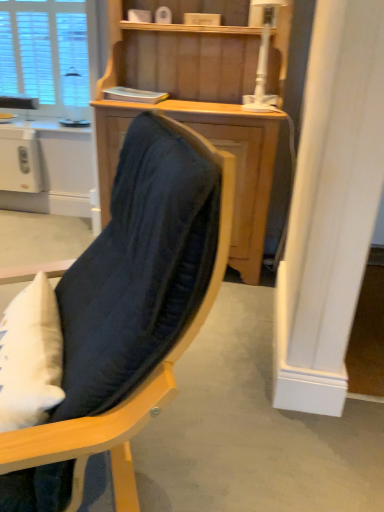
At what (x,y) coordinates should I click in order to perform the action: click on velvet dark blue chair at center. Please return your answer as a coordinate pair (x, y). Image resolution: width=384 pixels, height=512 pixels. Looking at the image, I should click on (144, 274).

At what (x,y) coordinates should I click in order to perform the action: click on white plastic lamp at upper center. Please return your answer as a coordinate pair (x, y). Looking at the image, I should click on (263, 59).

Identify the location of wooden cabinet at center. Image resolution: width=384 pixels, height=512 pixels. (195, 103).

Locate an element on the screen. velvet dark blue chair at center is located at coordinates (144, 274).

Does wooden cabinet at center appear on the right side of white textured window at upper left?

Correct, you'll find wooden cabinet at center to the right of white textured window at upper left.

From a real-world perspective, is wooden cabinet at center positioned over white textured window at upper left based on gravity?

Incorrect, from a real-world perspective, wooden cabinet at center is lower than white textured window at upper left.

Looking at this image, does wooden cabinet at center touch white textured window at upper left?

No, wooden cabinet at center is not beside white textured window at upper left.

Which object is thinner, white plastic lamp at upper center or white textured window at upper left?

white textured window at upper left.

How many degrees apart are the facing directions of white plastic lamp at upper center and white textured window at upper left?

1.45 degrees.

Which is behind, point (267, 26) or point (58, 84)?

The point (58, 84) is more distant.

Is white plastic lamp at upper center aimed at white textured window at upper left?

No.

Considering the relative positions of white plastic lamp at upper center and velvet dark blue chair at center in the image provided, is white plastic lamp at upper center behind velvet dark blue chair at center?

Yes, white plastic lamp at upper center is behind velvet dark blue chair at center.

Which is more to the left, white plastic lamp at upper center or velvet dark blue chair at center?

velvet dark blue chair at center.

Identify the location of lamp located on the right of velvet dark blue chair at center. The height and width of the screenshot is (512, 384). (263, 59).

Which is less distant, [267,33] or [199,208]?

Clearly, point [267,33] is more distant from the camera than point [199,208].

Which of these two, white textured window at upper left or velvet dark blue chair at center, is smaller?

white textured window at upper left.

Is white textured window at upper left not inside velvet dark blue chair at center?

white textured window at upper left is positioned outside velvet dark blue chair at center.

From a real-world perspective, is white textured window at upper left above or below velvet dark blue chair at center?

In terms of real-world spatial position, white textured window at upper left is above velvet dark blue chair at center.

How different are the orientations of white textured window at upper left and velvet dark blue chair at center in degrees?

The angular difference between white textured window at upper left and velvet dark blue chair at center is 68.1 degrees.

Consider the image. Between velvet dark blue chair at center and white plastic toaster at left, which one appears on the right side from the viewer's perspective?

velvet dark blue chair at center is more to the right.

From the image's perspective, between velvet dark blue chair at center and white plastic toaster at left, who is located below?

velvet dark blue chair at center is shown below in the image.

Is velvet dark blue chair at center oriented away from white plastic toaster at left?

No.

Does velvet dark blue chair at center have a larger size compared to white plastic toaster at left?

Correct, velvet dark blue chair at center is larger in size than white plastic toaster at left.

From a real-world perspective, between wooden cabinet at center and white plastic lamp at upper center, who is vertically higher?

From a 3D spatial view, white plastic lamp at upper center is above.

Consider the image. Would you say wooden cabinet at center is inside or outside white plastic lamp at upper center?

wooden cabinet at center cannot be found inside white plastic lamp at upper center.

Is the position of wooden cabinet at center more distant than that of white plastic lamp at upper center?

No, it is not.

Which of these two, wooden cabinet at center or white plastic lamp at upper center, is thinner?

white plastic lamp at upper center.

Is white plastic toaster at left positioned beyond the bounds of wooden cabinet at center?

Indeed, white plastic toaster at left is completely outside wooden cabinet at center.

Considering the relative positions of white plastic toaster at left and wooden cabinet at center in the image provided, is white plastic toaster at left to the left of wooden cabinet at center from the viewer's perspective?

Yes.

Which object is thinner, white plastic toaster at left or wooden cabinet at center?

white plastic toaster at left is thinner.

How far apart are white plastic toaster at left and wooden cabinet at center?

1.16 meters.

Locate an element on the screen. cupboard that is on the right side of white textured window at upper left is located at coordinates (195, 103).

Find the location of a particular element. The image size is (384, 512). window below the white plastic lamp at upper center (from a real-world perspective) is located at coordinates (44, 51).

Looking at the image, which one is located closer to velvet dark blue chair at center, white textured window at upper left or white plastic lamp at upper center?

Based on the image, white plastic lamp at upper center appears to be nearer to velvet dark blue chair at center.

Looking at this image, when comparing their distances from wooden cabinet at center, does velvet dark blue chair at center or white plastic lamp at upper center seem closer?

Among the two, white plastic lamp at upper center is located nearer to wooden cabinet at center.

Which object lies further to the anchor point white textured window at upper left, white plastic lamp at upper center or white plastic toaster at left?

white plastic lamp at upper center.

Which object lies further to the anchor point white plastic lamp at upper center, velvet dark blue chair at center or white textured window at upper left?

white textured window at upper left is further to white plastic lamp at upper center.

Considering their positions, is white plastic lamp at upper center positioned closer to wooden cabinet at center than white plastic toaster at left?

Based on the image, white plastic lamp at upper center appears to be nearer to wooden cabinet at center.

Based on their spatial positions, is white textured window at upper left or white plastic toaster at left closer to wooden cabinet at center?

The object closer to wooden cabinet at center is white plastic toaster at left.

Based on their spatial positions, is velvet dark blue chair at center or wooden cabinet at center closer to white textured window at upper left?

Among the two, wooden cabinet at center is located nearer to white textured window at upper left.

Considering their positions, is white textured window at upper left positioned further to wooden cabinet at center than white plastic lamp at upper center?

Among the two, white textured window at upper left is located further to wooden cabinet at center.

The height and width of the screenshot is (512, 384). In order to click on appliance between velvet dark blue chair at center and white textured window at upper left in the front-back direction in this screenshot , I will do `click(20, 160)`.

Where is `lamp between wooden cabinet at center and white textured window at upper left in the front-back direction`? The width and height of the screenshot is (384, 512). lamp between wooden cabinet at center and white textured window at upper left in the front-back direction is located at coordinates (263, 59).

Where is `cupboard between velvet dark blue chair at center and white plastic lamp at upper center in the front-back direction`? The width and height of the screenshot is (384, 512). cupboard between velvet dark blue chair at center and white plastic lamp at upper center in the front-back direction is located at coordinates (195, 103).

Where is `appliance between wooden cabinet at center and white textured window at upper left along the z-axis`? appliance between wooden cabinet at center and white textured window at upper left along the z-axis is located at coordinates (20, 160).